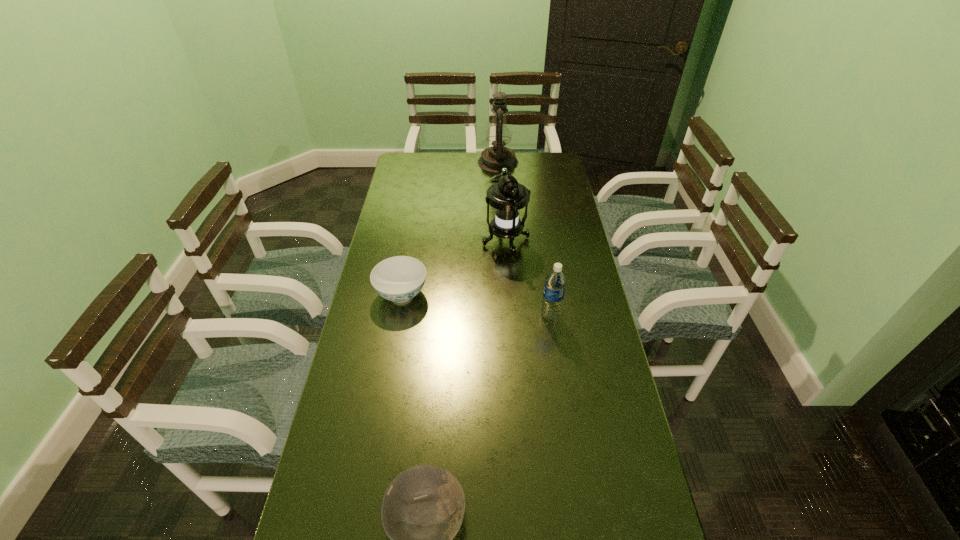
Identify the location of the tallest object. tap(493, 159).

Identify the location of oil lamp. (493, 159).

I want to click on the fourth shortest object, so click(x=507, y=196).

This screenshot has width=960, height=540. Find the location of `lantern`. lantern is located at coordinates (507, 196).

Where is `the third tallest object`? the third tallest object is located at coordinates (555, 282).

The width and height of the screenshot is (960, 540). In order to click on water bottle in this screenshot , I will do `click(555, 282)`.

This screenshot has width=960, height=540. In order to click on the fourth tallest object in this screenshot , I will do `click(400, 278)`.

The height and width of the screenshot is (540, 960). I want to click on vacant space located on the right of the oil lamp, so click(536, 162).

Where is `vacant region located 0.370m on the back of the second tallest object`? The width and height of the screenshot is (960, 540). vacant region located 0.370m on the back of the second tallest object is located at coordinates (501, 176).

Locate an element on the screen. This screenshot has width=960, height=540. vacant space positioned on the back of the rightmost object is located at coordinates (540, 245).